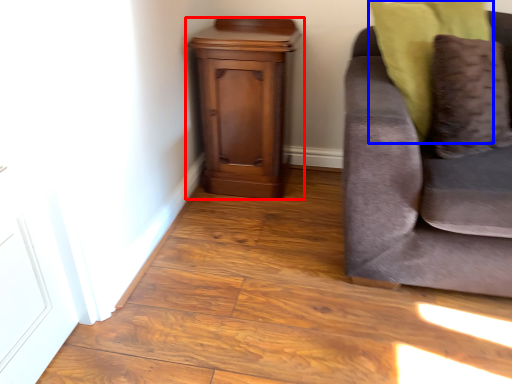
Question: Which object appears farthest to the camera in this image, nightstand (highlighted by a red box) or pillow (highlighted by a blue box)?

Choices:
 (A) nightstand
 (B) pillow

Answer: (A)